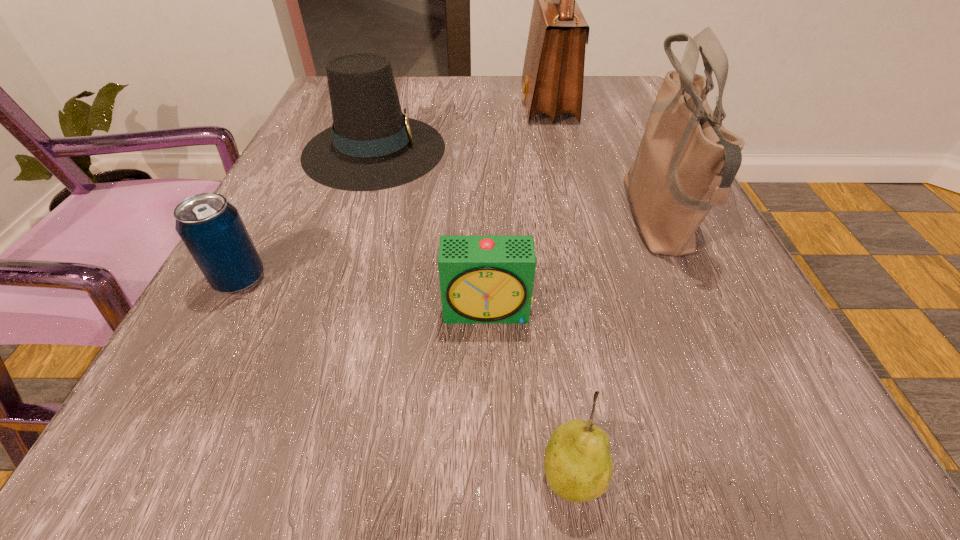
The width and height of the screenshot is (960, 540). Find the location of `hat present at the left edge`. hat present at the left edge is located at coordinates (372, 145).

Locate an element on the screen. The image size is (960, 540). soda can that is at the left edge is located at coordinates (211, 228).

You are a GUI agent. You are given a task and a screenshot of the screen. Output one action in this format:
    pyautogui.click(x=<x>, y=<y>)
    Task: Click on the object that is at the far left corner
    Image resolution: width=960 pixels, height=540 pixels.
    Given the screenshot: What is the action you would take?
    pyautogui.click(x=372, y=145)

Image resolution: width=960 pixels, height=540 pixels. Find the location of `object located in the far right corner section of the desktop`. object located in the far right corner section of the desktop is located at coordinates (553, 72).

At what (x,y) coordinates should I click in order to perform the action: click on free spot at the far edge of the desktop. Please return your answer as a coordinate pair (x, y). Looking at the image, I should click on (x=510, y=104).

Where is `vacant region at the near edge of the desktop`? The height and width of the screenshot is (540, 960). vacant region at the near edge of the desktop is located at coordinates (633, 472).

Where is `vacant space at the left edge of the desktop`? The image size is (960, 540). vacant space at the left edge of the desktop is located at coordinates (312, 122).

In order to click on vacant space at the right edge of the desktop in this screenshot , I will do `click(624, 198)`.

At what (x,y) coordinates should I click in order to perform the action: click on free space at the far right corner. Please return your answer as a coordinate pair (x, y). The height and width of the screenshot is (540, 960). Looking at the image, I should click on (607, 111).

I want to click on free spot between the nearest object and the soda can, so click(405, 377).